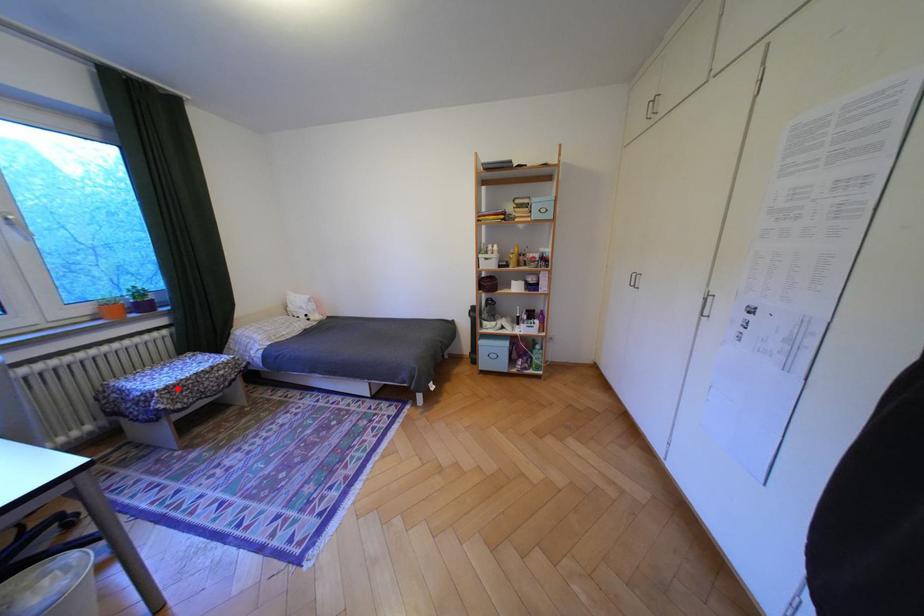
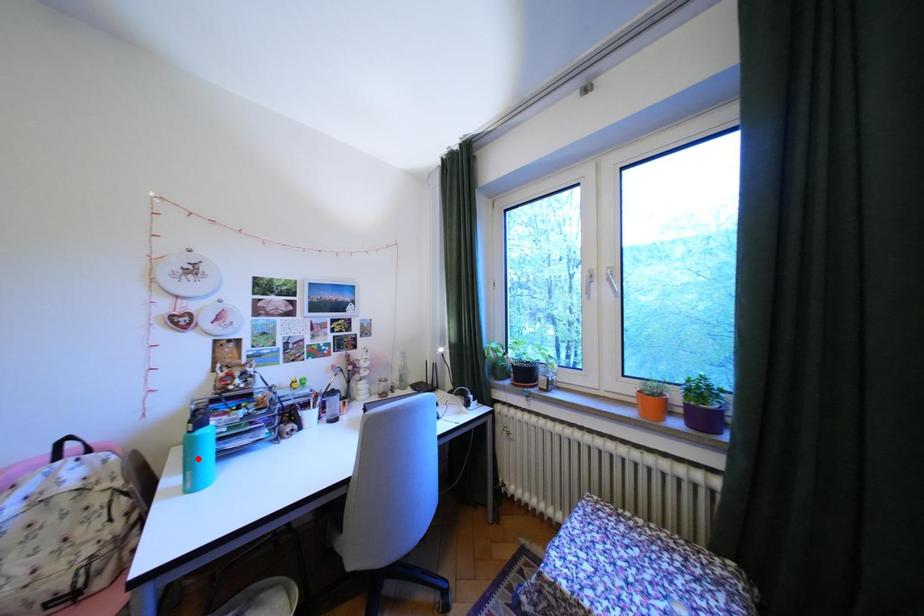
I am providing you with two images of the same scene from different viewpoints. A red point is marked on the first image and another point is marked on the second image. Does the point marked in image1 correspond to the same location as the one in image2?

No